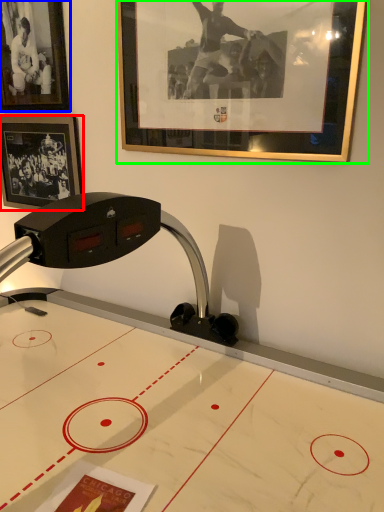
Question: Which is nearer to the picture frame (highlighted by a red box)? picture frame (highlighted by a blue box) or picture frame (highlighted by a green box).

Choices:
 (A) picture frame
 (B) picture frame

Answer: (A)